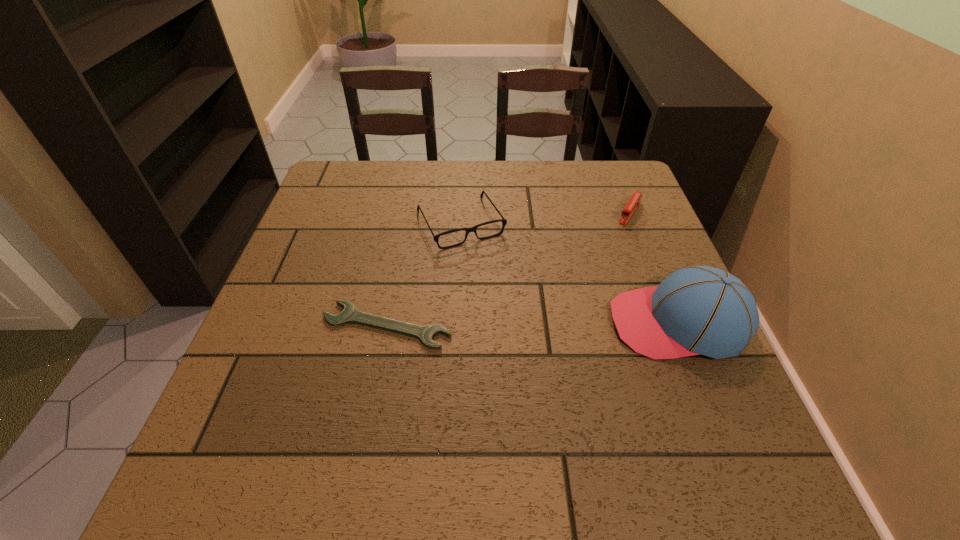
The width and height of the screenshot is (960, 540). Identify the location of wrench. (350, 315).

You are a GUI agent. You are given a task and a screenshot of the screen. Output one action in this format:
    pyautogui.click(x=<x>, y=<y>)
    Task: Click on the tallest object
    This screenshot has height=540, width=960.
    Given the screenshot: What is the action you would take?
    pyautogui.click(x=695, y=310)

At what (x,y) coordinates should I click in order to perform the action: click on stapler. Please return your answer as a coordinate pair (x, y). Looking at the image, I should click on (630, 208).

Find the location of `spectacles`. spectacles is located at coordinates (473, 229).

Where is `vacant area situated on the front of the wrench`? The image size is (960, 540). vacant area situated on the front of the wrench is located at coordinates (366, 433).

Identify the location of free region located on the front-facing side of the tallest object. The height and width of the screenshot is (540, 960). (534, 323).

You are a GUI agent. You are given a task and a screenshot of the screen. Output one action in this format:
    pyautogui.click(x=<x>, y=<y>)
    Task: Click on the vacant space located on the front-facing side of the tallest object
    Image resolution: width=960 pixels, height=540 pixels.
    Given the screenshot: What is the action you would take?
    pyautogui.click(x=505, y=323)

Identify the location of free spot located 0.060m on the front-facing side of the tallest object. (582, 323).

Where is `vacant space located 0.080m on the front-facing side of the stapler`? The height and width of the screenshot is (540, 960). vacant space located 0.080m on the front-facing side of the stapler is located at coordinates (616, 241).

This screenshot has width=960, height=540. What are the coordinates of `blank space located on the front-facing side of the stapler` in the screenshot? It's located at (583, 298).